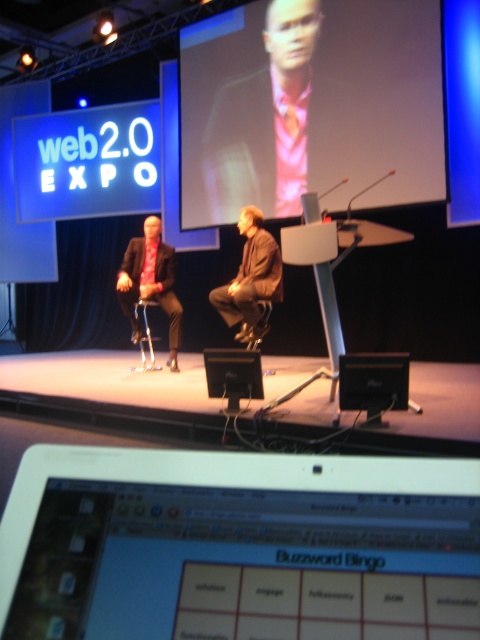
You are setting up a camera to capture the event. The matte black screen at center and the pink fabric at upper center are both in your frame. Which object is positioned higher in the image?

The pink fabric at upper center is positioned higher than the matte black screen at center because it is located at the upper part of the image.